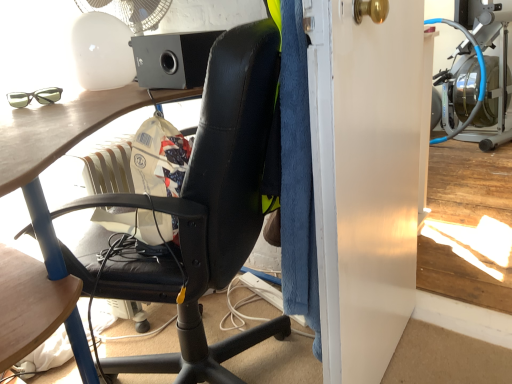
Locate an element on the screen. The image size is (512, 384). vacant region to the left of white glossy screen door at right is located at coordinates (265, 337).